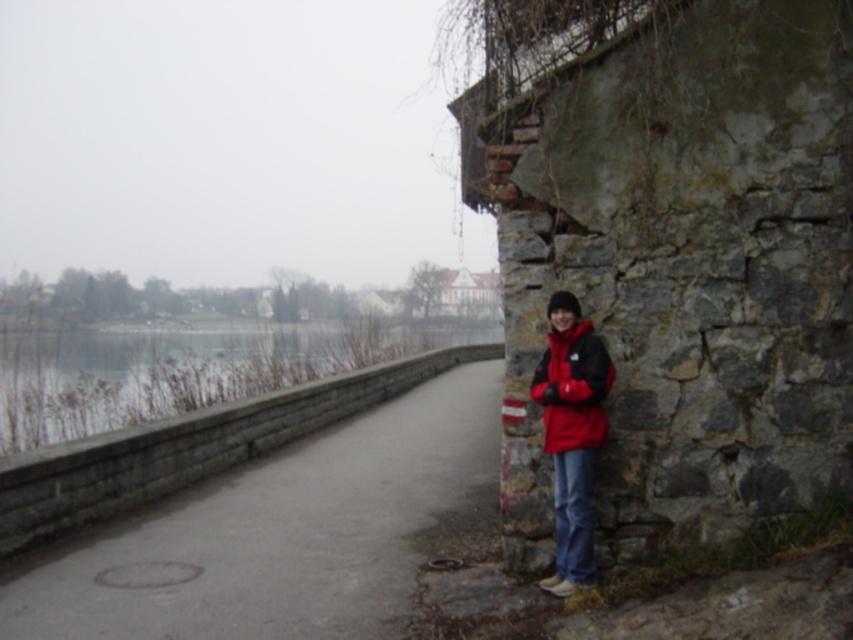
Is concrete sidewalk at center thinner than smooth concrete wall at left?

Indeed, concrete sidewalk at center has a lesser width compared to smooth concrete wall at left.

Does concrete sidewalk at center appear under smooth concrete wall at left?

Correct, concrete sidewalk at center is located below smooth concrete wall at left.

Measure the distance between point (x=390, y=592) and camera.

They are 5.45 meters apart.

Find the location of a particular element. The height and width of the screenshot is (640, 853). concrete sidewalk at center is located at coordinates (276, 534).

Does smooth concrete wall at left appear on the right side of red matte jacket at right?

No, smooth concrete wall at left is not to the right of red matte jacket at right.

Between smooth concrete wall at left and red matte jacket at right, which one appears on the right side from the viewer's perspective?

red matte jacket at right is more to the right.

The height and width of the screenshot is (640, 853). I want to click on smooth concrete wall at left, so click(x=202, y=378).

Is concrete sidewalk at center taller than red matte jacket at right?

Incorrect, concrete sidewalk at center's height is not larger of red matte jacket at right's.

Does point (316, 556) come behind point (587, 385)?

Yes.

You are a GUI agent. You are given a task and a screenshot of the screen. Output one action in this format:
    pyautogui.click(x=<x>, y=<y>)
    Task: Click on the concrete sidewalk at center
    
    Given the screenshot: What is the action you would take?
    pyautogui.click(x=276, y=534)